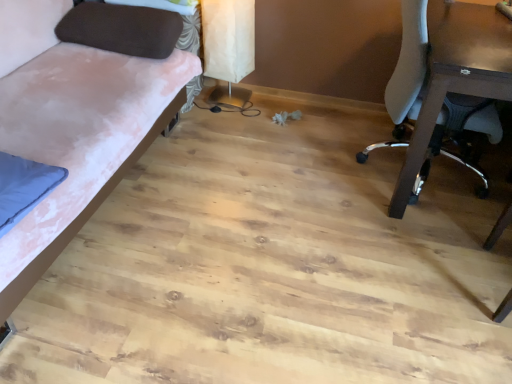
Question: Is velvet pink fabric couch at left wider than white paper lampshade at upper center?

Choices:
 (A) yes
 (B) no

Answer: (A)

Question: From a real-world perspective, does velvet pink fabric couch at left stand above white paper lampshade at upper center?

Choices:
 (A) no
 (B) yes

Answer: (B)

Question: From the image's perspective, is velvet pink fabric couch at left on top of white paper lampshade at upper center?

Choices:
 (A) no
 (B) yes

Answer: (A)

Question: Is velvet pink fabric couch at left taller than white paper lampshade at upper center?

Choices:
 (A) no
 (B) yes

Answer: (B)

Question: From a real-world perspective, is velvet pink fabric couch at left under white paper lampshade at upper center?

Choices:
 (A) yes
 (B) no

Answer: (B)

Question: Considering the relative sizes of velvet pink fabric couch at left and white paper lampshade at upper center in the image provided, is velvet pink fabric couch at left smaller than white paper lampshade at upper center?

Choices:
 (A) no
 (B) yes

Answer: (A)

Question: Is white mesh chair at right completely or partially outside of velvet pink fabric couch at left?

Choices:
 (A) no
 (B) yes

Answer: (B)

Question: From the image's perspective, does white mesh chair at right appear lower than velvet pink fabric couch at left?

Choices:
 (A) no
 (B) yes

Answer: (A)

Question: Is white mesh chair at right at the right side of velvet pink fabric couch at left?

Choices:
 (A) yes
 (B) no

Answer: (A)

Question: Does white mesh chair at right appear on the left side of velvet pink fabric couch at left?

Choices:
 (A) no
 (B) yes

Answer: (A)

Question: Does white mesh chair at right have a larger size compared to velvet pink fabric couch at left?

Choices:
 (A) no
 (B) yes

Answer: (A)

Question: Is white mesh chair at right not near velvet pink fabric couch at left?

Choices:
 (A) yes
 (B) no

Answer: (A)

Question: Is white mesh chair at right positioned in front of brown fabric pillow at upper left?

Choices:
 (A) no
 (B) yes

Answer: (B)